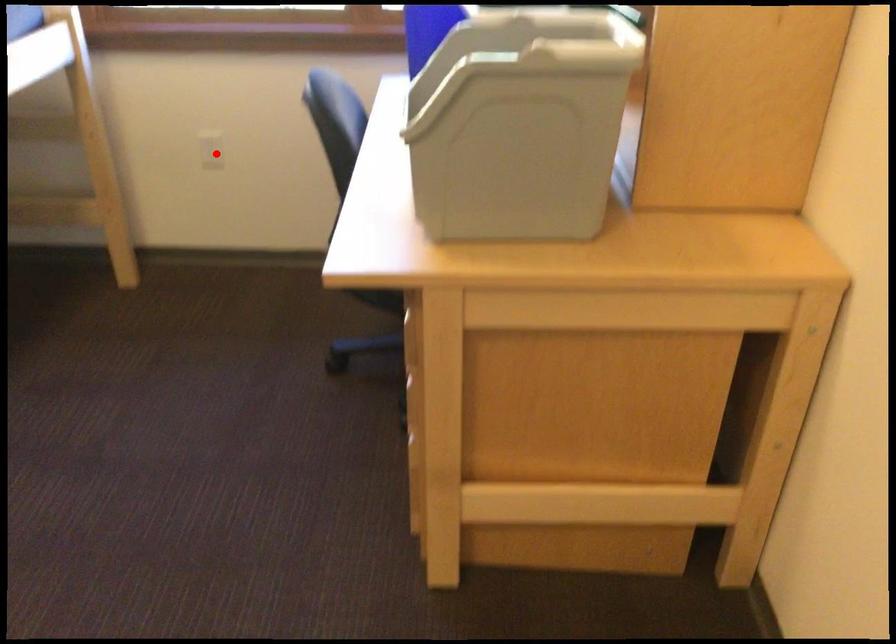
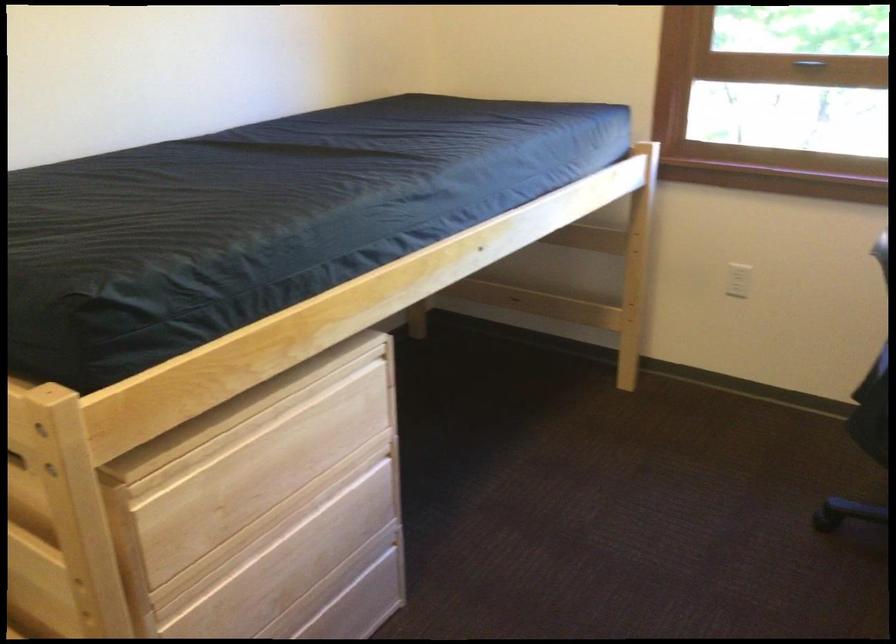
In the second image, find the point that corresponds to the highlighted location in the first image.

(738, 279)